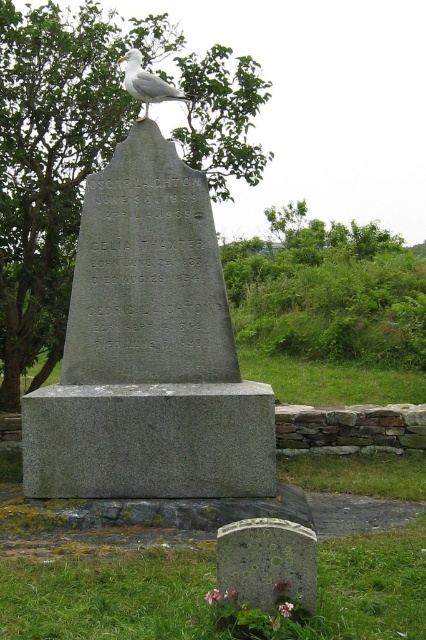
Question: Which of the following is the closest to the observer?

Choices:
 (A) (201, 259)
 (B) (316, 563)

Answer: (B)

Question: Can you confirm if speckled stone gravestone at lower center is wider than white feathered bird at upper center?

Choices:
 (A) yes
 (B) no

Answer: (B)

Question: Among these objects, which one is farthest from the camera?

Choices:
 (A) gray granite monument at center
 (B) speckled stone gravestone at lower center

Answer: (A)

Question: Is gray granite monument at center to the right of speckled stone gravestone at lower center from the viewer's perspective?

Choices:
 (A) no
 (B) yes

Answer: (A)

Question: Is gray granite monument at center further to the viewer compared to speckled stone gravestone at lower center?

Choices:
 (A) no
 (B) yes

Answer: (B)

Question: Which object is the farthest from the gray granite monument at center?

Choices:
 (A) speckled stone gravestone at lower center
 (B) white feathered bird at upper center

Answer: (A)